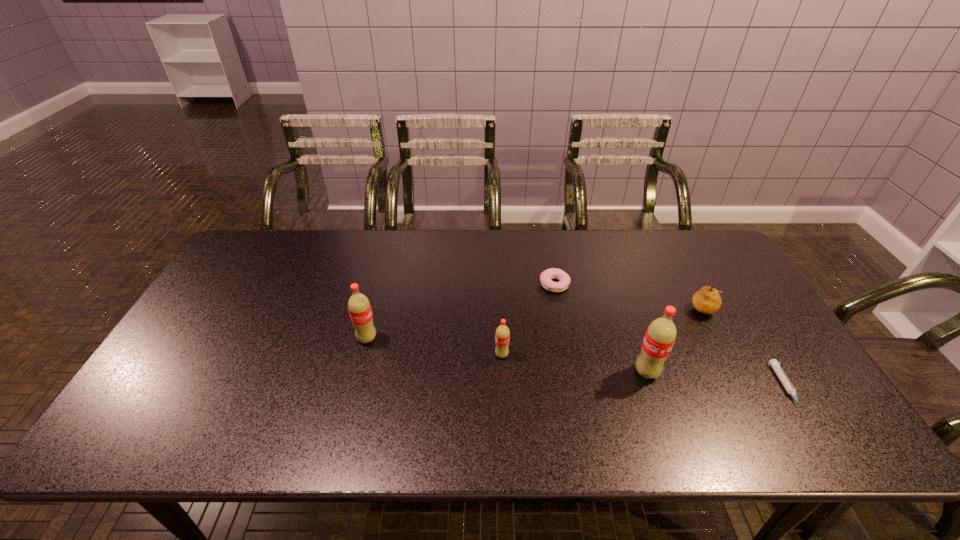
Where is `free space between the fourth tallest object and the third farthest object`? free space between the fourth tallest object and the third farthest object is located at coordinates (537, 324).

Identify the location of free space between the second soda from right to left and the fifth nearest object. This screenshot has height=540, width=960. (x=604, y=332).

At what (x,y) coordinates should I click in order to perform the action: click on empty space that is in between the syringe and the rightmost soda. Please return your answer as a coordinate pair (x, y). The height and width of the screenshot is (540, 960). Looking at the image, I should click on (716, 380).

Locate an element on the screen. Image resolution: width=960 pixels, height=540 pixels. free area in between the second farthest object and the third nearest object is located at coordinates 604,332.

This screenshot has width=960, height=540. What are the coordinates of `free space that is in between the fifth nearest object and the doughnut` in the screenshot? It's located at (631, 297).

At what (x,y) coordinates should I click in order to perform the action: click on free space that is in between the second farthest object and the fifth object from right to left. Please return your answer as a coordinate pair (x, y). Looking at the image, I should click on (604, 332).

Identify the location of object identified as the fourth closest to the fifth object from right to left. (707, 300).

This screenshot has width=960, height=540. Identify the location of object that ranks as the fifth closest to the fifth object from left to right. (359, 307).

Locate an element on the screen. The height and width of the screenshot is (540, 960). the closest soda relative to the syringe is located at coordinates click(660, 336).

At what (x,y) coordinates should I click in order to perform the action: click on soda that is the third closest to the doughnut. Please return your answer as a coordinate pair (x, y). Looking at the image, I should click on (359, 307).